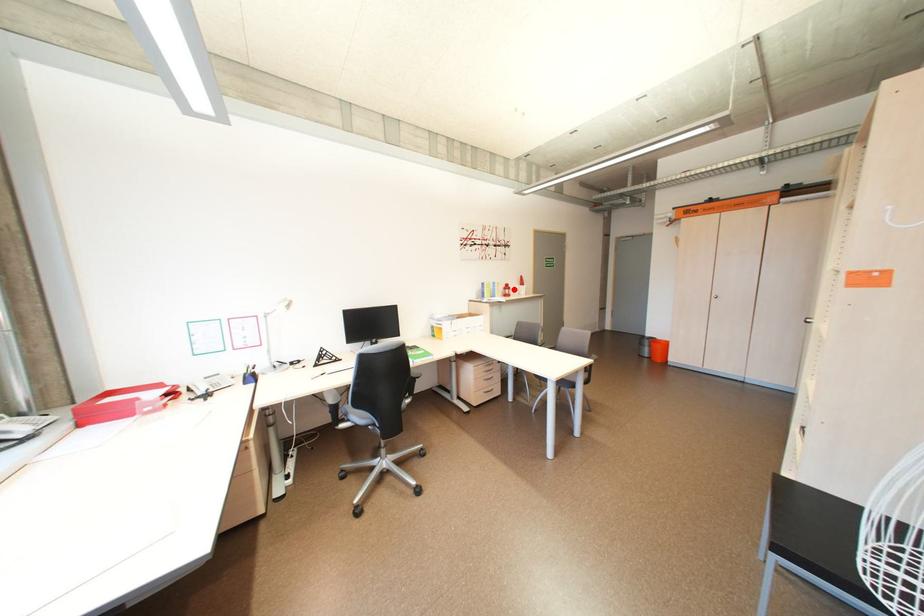
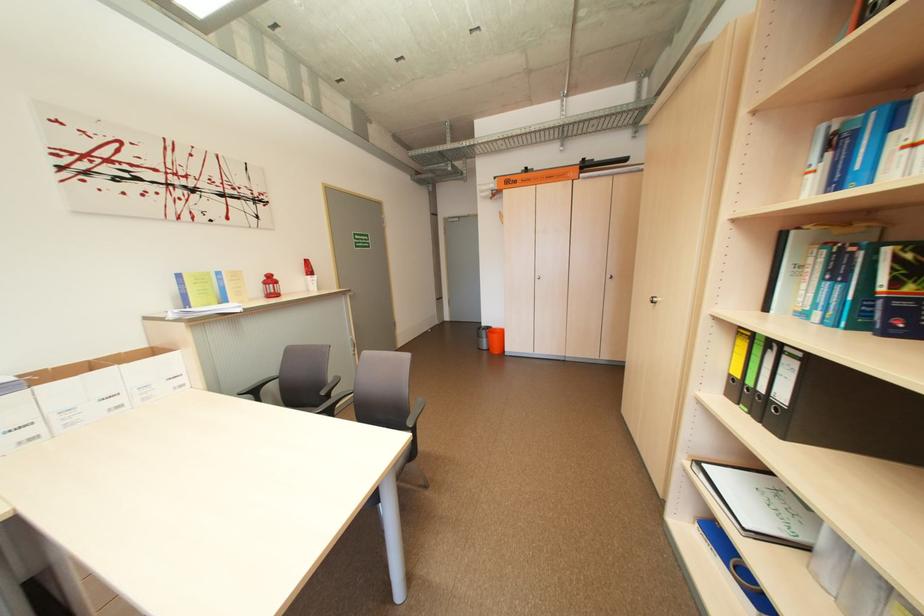
Where in the second image is the point corresponding to the highlighted location from the first image?

(274, 284)